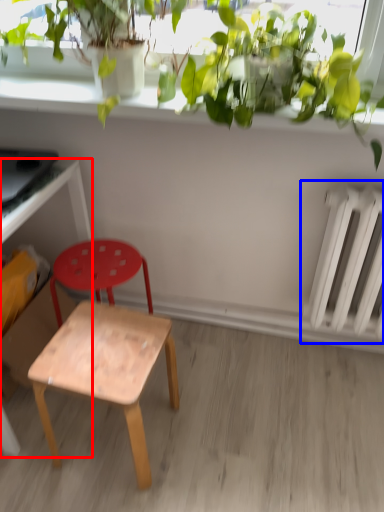
Question: Among these objects, which one is farthest to the camera, desk (highlighted by a red box) or radiator (highlighted by a blue box)?

Choices:
 (A) desk
 (B) radiator

Answer: (B)